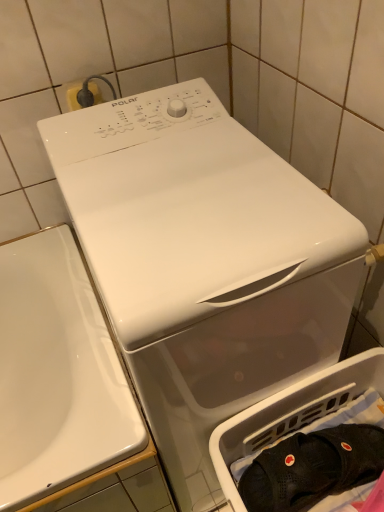
Image resolution: width=384 pixels, height=512 pixels. Find the location of `black mesh socks at lower right`. black mesh socks at lower right is located at coordinates (313, 468).

Could you tell me if white glossy washing machine at center is facing black mesh socks at lower right?

Yes, white glossy washing machine at center is turned towards black mesh socks at lower right.

Which of these two, white glossy washing machine at center or black mesh socks at lower right, is wider?

With larger width is white glossy washing machine at center.

Can you tell me how much white glossy washing machine at center and black mesh socks at lower right differ in facing direction?

The angle between the facing direction of white glossy washing machine at center and the facing direction of black mesh socks at lower right is 103 degrees.

Are white glossy washing machine at center and black mesh socks at lower right beside each other?

There is a gap between white glossy washing machine at center and black mesh socks at lower right.

Identify the location of washing machine in front of the black mesh socks at lower right. (204, 263).

From a real-world perspective, is black mesh socks at lower right physically located above or below white glossy washing machine at center?

Clearly, from a real-world perspective, black mesh socks at lower right is below white glossy washing machine at center.

In the scene shown: Who is more distant, black mesh socks at lower right or white glossy washing machine at center?

black mesh socks at lower right is further away from the camera.

Is black mesh socks at lower right taller than white glossy washing machine at center?

In fact, black mesh socks at lower right may be shorter than white glossy washing machine at center.

Considering the sizes of black mesh socks at lower right and black mesh bag at lower right in the image, is black mesh socks at lower right bigger or smaller than black mesh bag at lower right?

black mesh socks at lower right is smaller than black mesh bag at lower right.

In the image, is black mesh socks at lower right on the left side or the right side of black mesh bag at lower right?

black mesh socks at lower right is positioned on black mesh bag at lower right's left side.

From their relative heights in the image, would you say black mesh socks at lower right is taller or shorter than black mesh bag at lower right?

In the image, black mesh socks at lower right appears to be shorter than black mesh bag at lower right.

From a real-world perspective, who is located higher, black mesh socks at lower right or black mesh bag at lower right?

black mesh socks at lower right, from a real-world perspective.

Considering the sizes of objects black mesh bag at lower right and black mesh socks at lower right in the image provided, who is shorter, black mesh bag at lower right or black mesh socks at lower right?

black mesh socks at lower right.

Is black mesh bag at lower right to the left or to the right of black mesh socks at lower right in the image?

Based on their positions, black mesh bag at lower right is located to the right of black mesh socks at lower right.

Could black mesh socks at lower right be considered to be inside black mesh bag at lower right?

Indeed, black mesh socks at lower right is located within black mesh bag at lower right.

From a real-world perspective, who is located higher, black mesh bag at lower right or white glossy washing machine at center?

white glossy washing machine at center.

Between black mesh bag at lower right and white glossy washing machine at center, which one has smaller width?

Thinner between the two is black mesh bag at lower right.

Is black mesh bag at lower right oriented away from white glossy washing machine at center?

No, black mesh bag at lower right is not facing away from white glossy washing machine at center.

From a real-world perspective, which object rests below the other?

black mesh bag at lower right, from a real-world perspective.

Is white glossy washing machine at center with black mesh bag at lower right?

white glossy washing machine at center and black mesh bag at lower right are not in contact.

Which is in front, point (274, 280) or point (290, 432)?

The point (274, 280) is in front.

Is white glossy washing machine at center wider than black mesh bag at lower right?

Correct, the width of white glossy washing machine at center exceeds that of black mesh bag at lower right.

Where is `clothing below the white glossy washing machine at center (from the image's perspective)`? The image size is (384, 512). clothing below the white glossy washing machine at center (from the image's perspective) is located at coordinates (313, 468).

You are a GUI agent. You are given a task and a screenshot of the screen. Output one action in this format:
    pyautogui.click(x=<x>, y=<y>)
    Task: Click on the washing machine on the left side of black mesh socks at lower right
    
    Given the screenshot: What is the action you would take?
    pyautogui.click(x=204, y=263)

Which object lies further to the anchor point white glossy washing machine at center, black mesh socks at lower right or black mesh bag at lower right?

black mesh socks at lower right lies further to white glossy washing machine at center than the other object.

Looking at this image, when comparing their distances from black mesh socks at lower right, does black mesh bag at lower right or white glossy washing machine at center seem further?

Among the two, white glossy washing machine at center is located further to black mesh socks at lower right.

Looking at the image, which one is located closer to black mesh socks at lower right, white glossy washing machine at center or black mesh bag at lower right?

black mesh bag at lower right.

Estimate the real-world distances between objects in this image. Which object is further from white glossy washing machine at center, black mesh bag at lower right or black mesh socks at lower right?

The object further to white glossy washing machine at center is black mesh socks at lower right.

From the image, which object appears to be nearer to black mesh bag at lower right, black mesh socks at lower right or white glossy washing machine at center?

black mesh socks at lower right lies closer to black mesh bag at lower right than the other object.

Which object lies further to the anchor point black mesh bag at lower right, white glossy washing machine at center or black mesh socks at lower right?

The object further to black mesh bag at lower right is white glossy washing machine at center.

Identify the location of clothing between white glossy washing machine at center and black mesh bag at lower right from top to bottom. (313, 468).